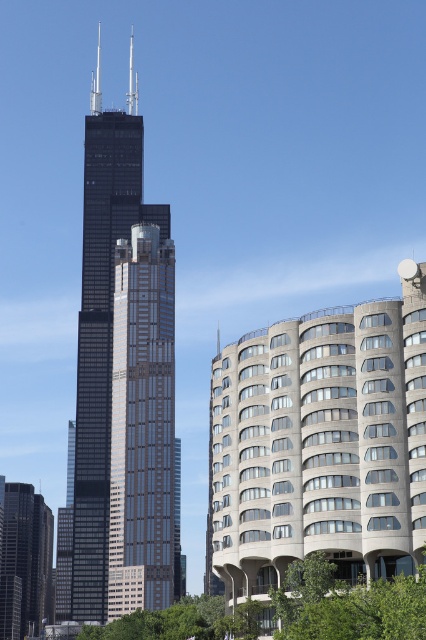
Question: Can you confirm if gray concrete building at right is thinner than green leafy tree at lower right?

Choices:
 (A) no
 (B) yes

Answer: (A)

Question: Which of the following is the closest to the observer?

Choices:
 (A) gray concrete building at right
 (B) gold glass skyscraper at center
 (C) green leafy tree at lower right
 (D) black glass skyscraper at center

Answer: (C)

Question: Which object appears closest to the camera in this image?

Choices:
 (A) gray concrete building at right
 (B) green leafy tree at lower right
 (C) gold glass skyscraper at center

Answer: (B)

Question: Is black glass skyscraper at center below green leafy tree at lower right?

Choices:
 (A) yes
 (B) no

Answer: (B)

Question: Which point is farther to the camera?

Choices:
 (A) gray concrete building at right
 (B) black glass skyscraper at center
 (C) green leafy tree at lower right

Answer: (B)

Question: Can you confirm if black glass skyscraper at center is bigger than green leafy tree at lower right?

Choices:
 (A) yes
 (B) no

Answer: (A)